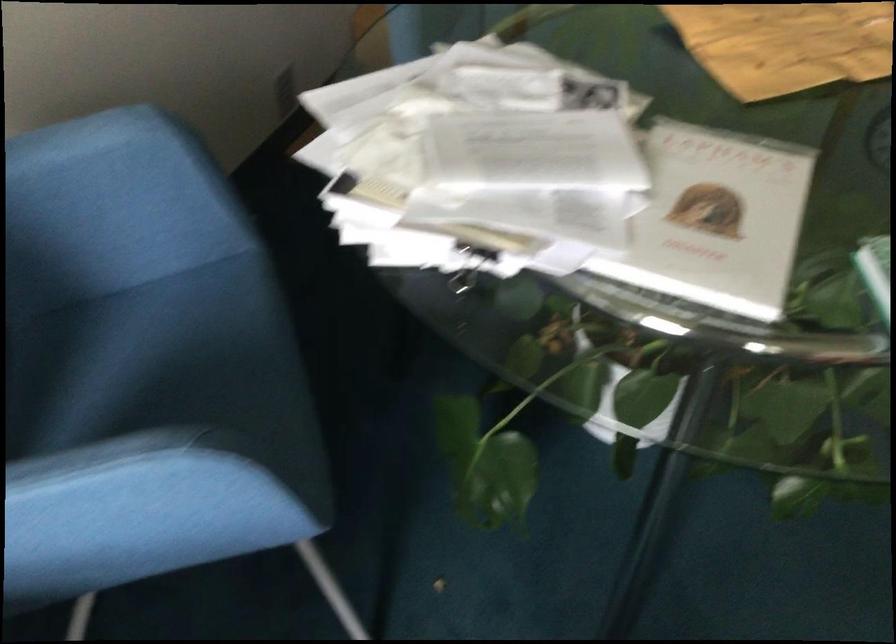
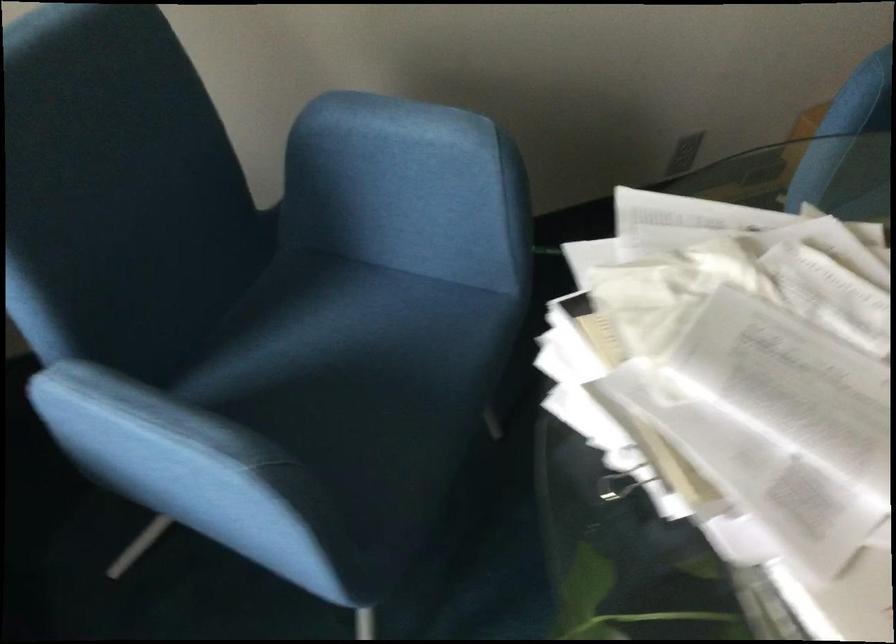
Question: I am providing you with two images of the same scene from different viewpoints. Please identify which objects are invisible in image2.

Choices:
 (A) blue chair sitting surface
 (B) blue chair armrest
 (C) red teddy bear
 (D) binder clip

Answer: (D)